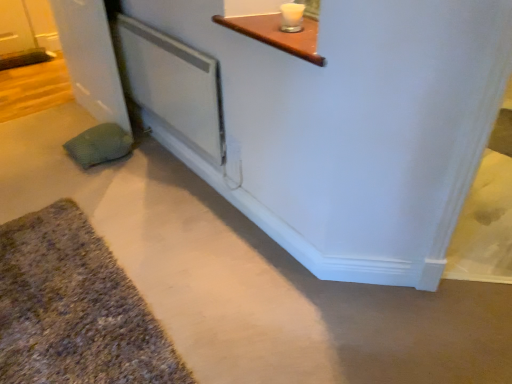
Question: Is white plastic screen door at center inside or outside of textured gray bath mat at lower left?

Choices:
 (A) inside
 (B) outside

Answer: (B)

Question: From the image's perspective, is white plastic screen door at center positioned above or below textured gray bath mat at lower left?

Choices:
 (A) above
 (B) below

Answer: (A)

Question: Which object is the farthest from the textured gray bath mat at lower left?

Choices:
 (A) white plastic screen door at center
 (B) green textured pillow at lower left
 (C) white glossy door at left

Answer: (C)

Question: Which is farther from the white glossy door at left?

Choices:
 (A) green textured pillow at lower left
 (B) textured gray bath mat at lower left
 (C) white plastic screen door at center

Answer: (B)